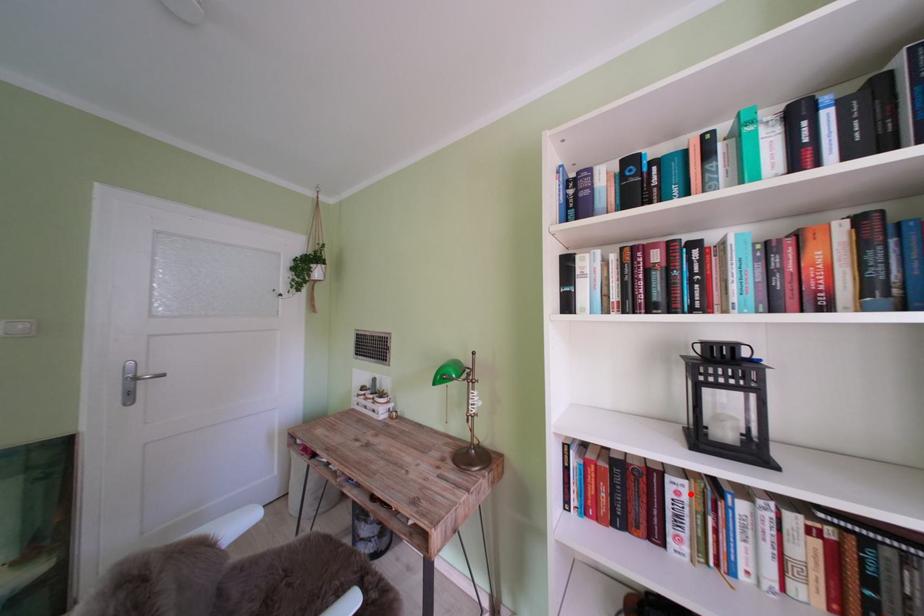
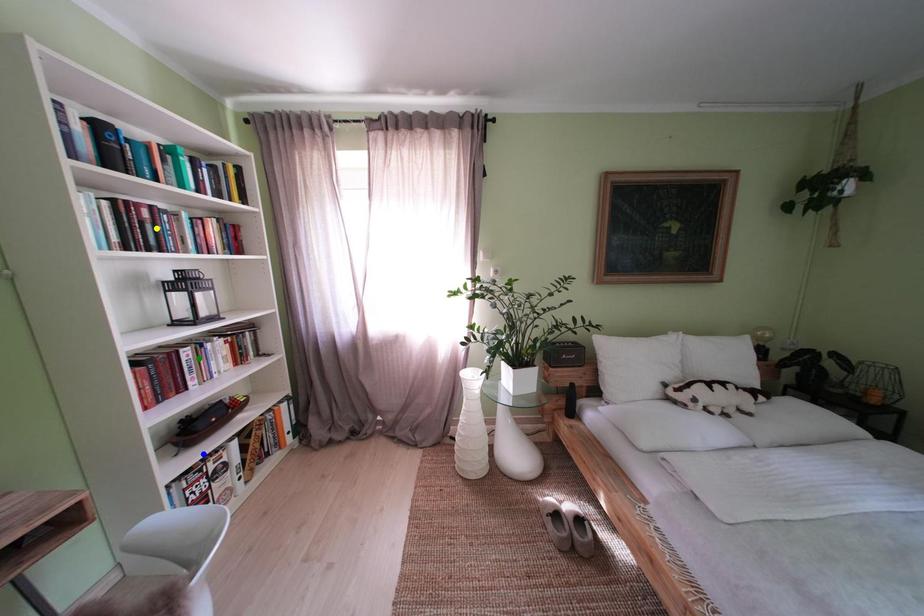
Question: I am providing you with two images of the same scene from different viewpoints. A red point is marked on the first image. You are given multiple points on the second image. Which point in image 2 represents the same 3d spot as the red point in image 1?

Choices:
 (A) green point
 (B) yellow point
 (C) blue point

Answer: (A)